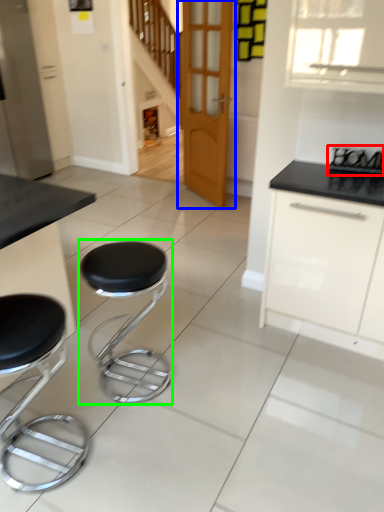
Question: Which object is the closest to the appliance (highlighted by a red box)? Choose among these: door (highlighted by a blue box) or stool (highlighted by a green box).

Choices:
 (A) door
 (B) stool

Answer: (B)